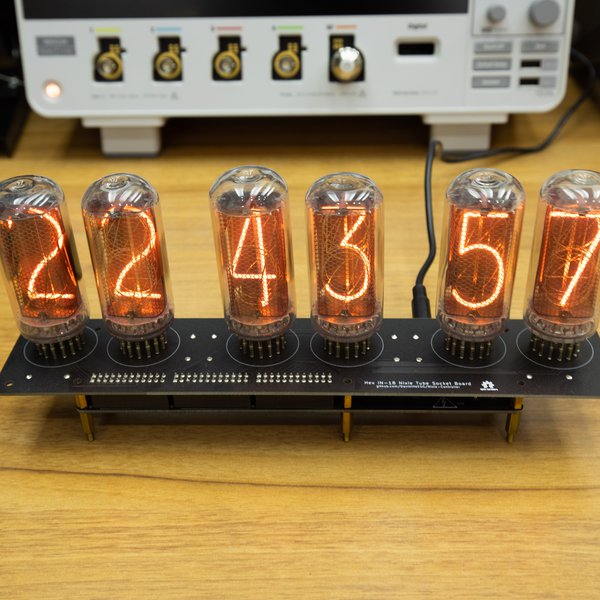
Find the location of `black receiver`. black receiver is located at coordinates [x=10, y=117].